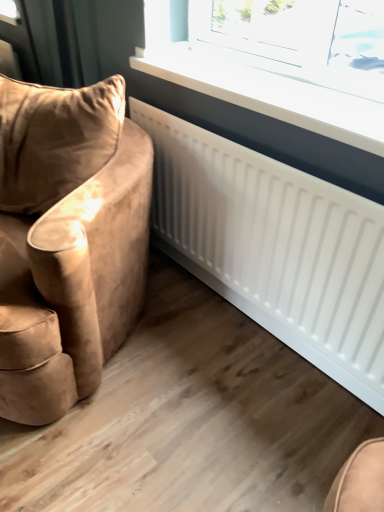
Question: Does white glossy radiator at upper center have a lesser width compared to suede-like brown armchair at left?

Choices:
 (A) yes
 (B) no

Answer: (A)

Question: Is white glossy radiator at upper center outside suede-like brown armchair at left?

Choices:
 (A) yes
 (B) no

Answer: (A)

Question: From the image's perspective, is white glossy radiator at upper center beneath suede-like brown armchair at left?

Choices:
 (A) no
 (B) yes

Answer: (A)

Question: Does white glossy radiator at upper center have a smaller size compared to suede-like brown armchair at left?

Choices:
 (A) yes
 (B) no

Answer: (A)

Question: Is white glossy radiator at upper center next to suede-like brown armchair at left and touching it?

Choices:
 (A) yes
 (B) no

Answer: (B)

Question: Would you say white glossy radiator at upper center contains suede-like brown armchair at left?

Choices:
 (A) yes
 (B) no

Answer: (B)

Question: From a real-world perspective, is suede-like brown armchair at left beneath white glossy radiator at upper center?

Choices:
 (A) no
 (B) yes

Answer: (B)

Question: Considering the relative sizes of suede-like brown armchair at left and white glossy radiator at upper center in the image provided, is suede-like brown armchair at left wider than white glossy radiator at upper center?

Choices:
 (A) yes
 (B) no

Answer: (A)

Question: Can you confirm if suede-like brown armchair at left is thinner than white glossy radiator at upper center?

Choices:
 (A) no
 (B) yes

Answer: (A)

Question: Is suede-like brown armchair at left facing towards white glossy radiator at upper center?

Choices:
 (A) no
 (B) yes

Answer: (A)

Question: From the image's perspective, is suede-like brown armchair at left below white glossy radiator at upper center?

Choices:
 (A) yes
 (B) no

Answer: (A)

Question: Are suede-like brown armchair at left and white glossy radiator at upper center located far from each other?

Choices:
 (A) yes
 (B) no

Answer: (B)

Question: Is point (74, 193) closer or farther from the camera than point (226, 17)?

Choices:
 (A) farther
 (B) closer

Answer: (B)